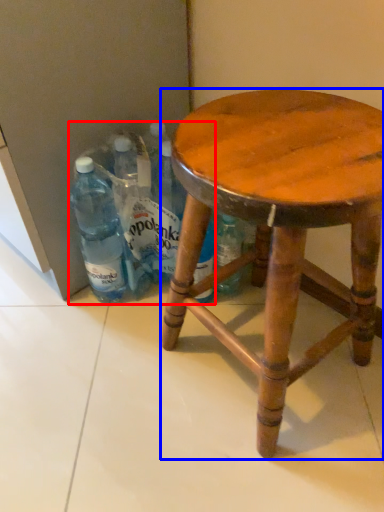
Question: Among these objects, which one is farthest to the camera, beverage (highlighted by a red box) or stool (highlighted by a blue box)?

Choices:
 (A) beverage
 (B) stool

Answer: (A)